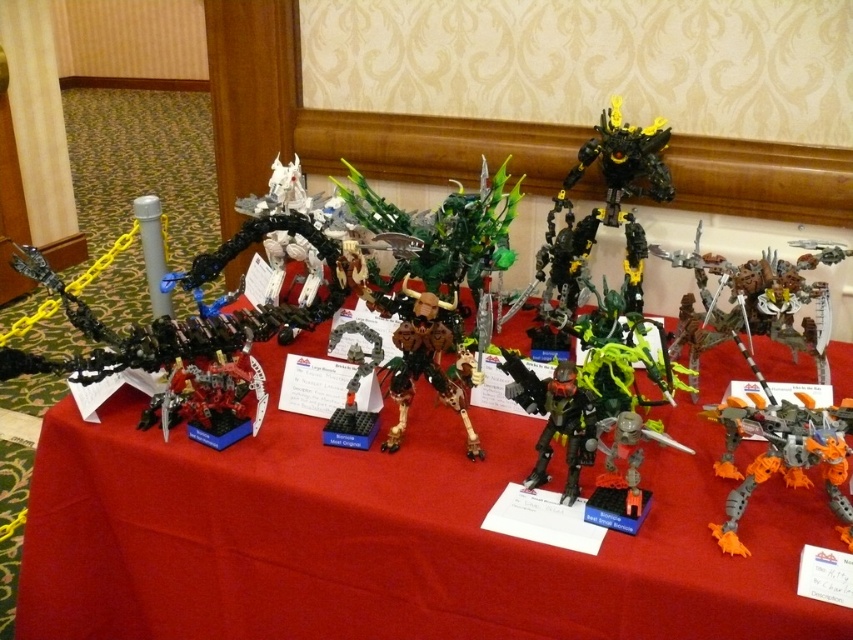
Is point (634, 576) closer to camera compared to point (735, 493)?

Yes, it is in front of point (735, 493).

Is point (267, 547) more distant than point (749, 468)?

That is True.

Where is `red fabric tablecloth at center`? The image size is (853, 640). red fabric tablecloth at center is located at coordinates (386, 538).

Does point (689, 481) lie in front of point (593, 456)?

No, (689, 481) is behind (593, 456).

Looking at this image, does red fabric tablecloth at center appear on the right side of shiny black armor at center?

In fact, red fabric tablecloth at center is to the left of shiny black armor at center.

The height and width of the screenshot is (640, 853). Find the location of `red fabric tablecloth at center`. red fabric tablecloth at center is located at coordinates (386, 538).

Does point (830, 493) come in front of point (566, 417)?

Yes, point (830, 493) is closer to viewer.

Locate an element on the screen. This screenshot has width=853, height=640. orange matte robot at lower right is located at coordinates (782, 454).